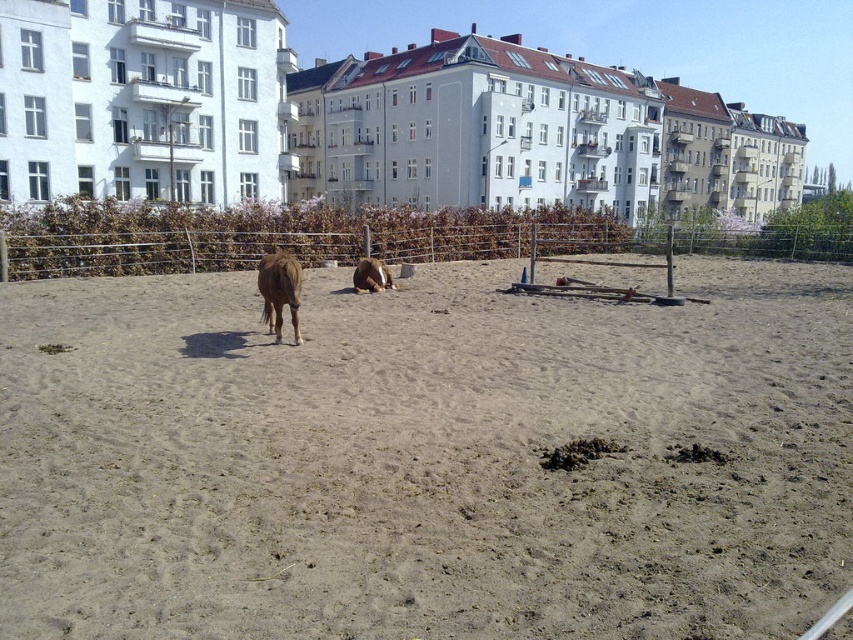
Is brown sandy ground at center thinner than brown wire mesh fence at upper center?

Yes.

Based on the photo, does brown sandy ground at center appear under brown wire mesh fence at upper center?

Yes.

Is point (740, 269) positioned before point (352, 260)?

That is True.

Where is `brown sandy ground at center`? This screenshot has width=853, height=640. brown sandy ground at center is located at coordinates (424, 458).

Which is above, brown wire mesh fence at upper center or brown fuzzy horse at center?

brown wire mesh fence at upper center is above.

The height and width of the screenshot is (640, 853). Identify the location of brown wire mesh fence at upper center. (167, 252).

Which is more to the left, brown wire mesh fence at upper center or brown furry horse at center?

From the viewer's perspective, brown furry horse at center appears more on the left side.

You are a GUI agent. You are given a task and a screenshot of the screen. Output one action in this format:
    pyautogui.click(x=<x>, y=<y>)
    Task: Click on the brown wire mesh fence at upper center
    
    Given the screenshot: What is the action you would take?
    pyautogui.click(x=167, y=252)

At what (x,y) coordinates should I click in order to perform the action: click on brown wire mesh fence at upper center. Please return your answer as a coordinate pair (x, y). The image size is (853, 640). Looking at the image, I should click on (167, 252).